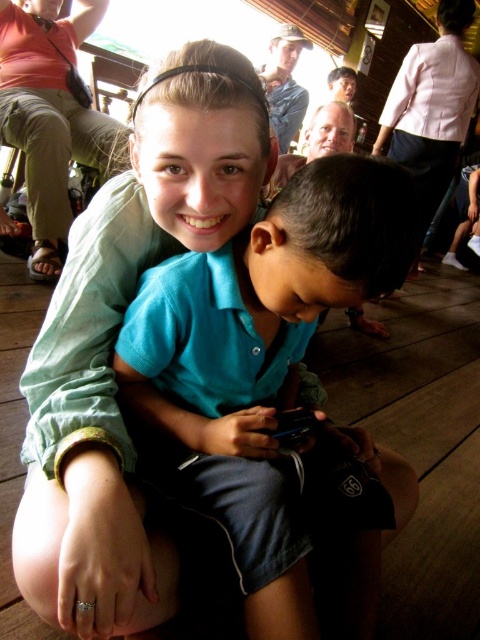
Question: Can you confirm if blue cotton shirt at center is bigger than green cotton shirt at upper center?

Choices:
 (A) no
 (B) yes

Answer: (A)

Question: Is blue cotton shirt at center to the right of green cotton shirt at upper center from the viewer's perspective?

Choices:
 (A) yes
 (B) no

Answer: (A)

Question: Among these points, which one is farthest from the camera?

Choices:
 (A) (360, 177)
 (B) (17, 534)

Answer: (B)

Question: Does blue cotton shirt at center lie behind green cotton shirt at upper center?

Choices:
 (A) yes
 (B) no

Answer: (A)